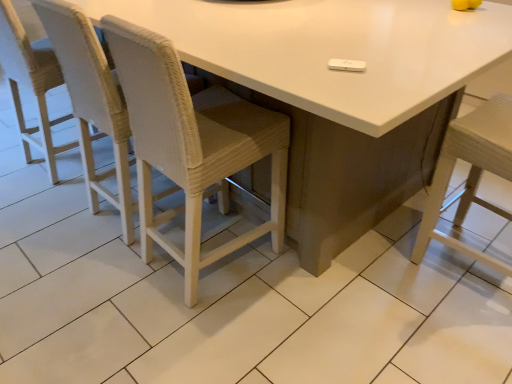
Describe the element at coordinates (31, 84) in the screenshot. This screenshot has width=512, height=384. I see `woven fabric chair at left, the first chair in the left-to-right sequence` at that location.

The image size is (512, 384). What do you see at coordinates (193, 144) in the screenshot?
I see `woven white chair at center, the third chair in the left-to-right sequence` at bounding box center [193, 144].

I want to click on woven white chair at left, which ranks as the second chair in right-to-left order, so click(x=92, y=101).

Considering the sizes of woven white chair at center, the third chair in the left-to-right sequence, and woven white chair at left, which ranks as the second chair in right-to-left order, in the image, is woven white chair at center, the third chair in the left-to-right sequence, wider or thinner than woven white chair at left, which ranks as the second chair in right-to-left order,?

woven white chair at center, the third chair in the left-to-right sequence, is thinner than woven white chair at left, which ranks as the second chair in right-to-left order.

Does woven white chair at center, which is counted as the first chair, starting from the right, turn towards woven white chair at left, which ranks as the second chair in right-to-left order?

No, woven white chair at center, which is counted as the first chair, starting from the right, is not aimed at woven white chair at left, which ranks as the second chair in right-to-left order.

Who is smaller, woven white chair at center, which is counted as the first chair, starting from the right, or woven white chair at left, which ranks as the second chair in right-to-left order?

woven white chair at center, which is counted as the first chair, starting from the right, is smaller.

Considering the positions of objects woven white chair at center, the third chair in the left-to-right sequence, and woven white chair at left, which ranks as the second chair in right-to-left order, in the image provided, who is in front, woven white chair at center, the third chair in the left-to-right sequence, or woven white chair at left, which ranks as the second chair in right-to-left order,?

woven white chair at center, the third chair in the left-to-right sequence, is in front.

Which is behind, point (45, 98) or point (450, 49)?

Point (45, 98)

From the image's perspective, would you say woven fabric chair at left, the 3th chair viewed from the right, is shown under white glossy table at center?

No, from the image's perspective, woven fabric chair at left, the 3th chair viewed from the right, is not beneath white glossy table at center.

From a real-world perspective, who is located higher, woven fabric chair at left, the first chair in the left-to-right sequence, or white glossy table at center?

In real-world perspective, woven fabric chair at left, the first chair in the left-to-right sequence, is above.

Can you confirm if woven fabric chair at left, the 3th chair viewed from the right, is wider than white glossy table at center?

Incorrect, the width of woven fabric chair at left, the 3th chair viewed from the right, does not surpass that of white glossy table at center.

Measure the distance from woven white chair at left, which ranks as the second chair in right-to-left order, to woven white chair at center, which is counted as the first chair, starting from the right.

woven white chair at left, which ranks as the second chair in right-to-left order, and woven white chair at center, which is counted as the first chair, starting from the right, are 13.02 inches apart from each other.

Looking at this image, relative to woven white chair at center, the third chair in the left-to-right sequence, is woven white chair at left, which is the 2th chair from left to right, in front or behind?

woven white chair at left, which is the 2th chair from left to right, is behind woven white chair at center, the third chair in the left-to-right sequence.

From the image's perspective, is woven white chair at left, which ranks as the second chair in right-to-left order, on top of woven white chair at center, the third chair in the left-to-right sequence?

Correct, woven white chair at left, which ranks as the second chair in right-to-left order, appears higher than woven white chair at center, the third chair in the left-to-right sequence, in the image.

Is white glossy table at center bigger or smaller than woven fabric chair at left, the first chair in the left-to-right sequence?

Clearly, white glossy table at center is larger in size than woven fabric chair at left, the first chair in the left-to-right sequence.

In the image, there is a woven fabric chair at left, the 3th chair viewed from the right. Identify the location of table below it (from the image's perspective). The image size is (512, 384). (338, 92).

From a real-world perspective, which is physically below, white glossy table at center or woven fabric chair at left, the first chair in the left-to-right sequence?

white glossy table at center, from a real-world perspective.

Does point (399, 58) appear closer or farther from the camera than point (28, 155)?

Point (399, 58) is closer to the camera than point (28, 155).

Is white glossy table at center thinner than woven white chair at left, which ranks as the second chair in right-to-left order?

No, white glossy table at center is not thinner than woven white chair at left, which ranks as the second chair in right-to-left order.

How much distance is there between white glossy table at center and woven white chair at left, which is the 2th chair from left to right?

white glossy table at center and woven white chair at left, which is the 2th chair from left to right, are 71.02 centimeters apart from each other.

Considering the relative sizes of white glossy table at center and woven white chair at left, which ranks as the second chair in right-to-left order, in the image provided, is white glossy table at center bigger than woven white chair at left, which ranks as the second chair in right-to-left order,?

Yes.

From the image's perspective, is white glossy table at center over woven white chair at center, which is counted as the first chair, starting from the right?

Yes, from the image's perspective, white glossy table at center is on top of woven white chair at center, which is counted as the first chair, starting from the right.

Could woven white chair at center, which is counted as the first chair, starting from the right, be considered to be inside white glossy table at center?

Yes, woven white chair at center, which is counted as the first chair, starting from the right, is a part of white glossy table at center.

Considering the relative positions of white glossy table at center and woven white chair at center, the third chair in the left-to-right sequence, in the image provided, is white glossy table at center to the left of woven white chair at center, the third chair in the left-to-right sequence, from the viewer's perspective?

Incorrect, white glossy table at center is not on the left side of woven white chair at center, the third chair in the left-to-right sequence.

From a real-world perspective, which is physically above, white glossy table at center or woven white chair at center, which is counted as the first chair, starting from the right?

woven white chair at center, which is counted as the first chair, starting from the right, is physically above.

Considering the relative sizes of woven white chair at center, which is counted as the first chair, starting from the right, and white glossy table at center in the image provided, is woven white chair at center, which is counted as the first chair, starting from the right, bigger than white glossy table at center?

No, woven white chair at center, which is counted as the first chair, starting from the right, is not bigger than white glossy table at center.

Relative to white glossy table at center, is woven white chair at center, the third chair in the left-to-right sequence, in front or behind?

Visually, woven white chair at center, the third chair in the left-to-right sequence, is located behind white glossy table at center.

Is woven white chair at center, the third chair in the left-to-right sequence, to the left or to the right of white glossy table at center in the image?

Based on their positions, woven white chair at center, the third chair in the left-to-right sequence, is located to the left of white glossy table at center.

Does point (156, 117) come closer to viewer compared to point (495, 36)?

Yes.

Find the location of a particular element. The height and width of the screenshot is (384, 512). chair that is the 1st object located behind the woven white chair at center, the third chair in the left-to-right sequence is located at coordinates [92, 101].

Find the location of a particular element. The height and width of the screenshot is (384, 512). table directly beneath the woven fabric chair at left, the 3th chair viewed from the right (from a real-world perspective) is located at coordinates (338, 92).

Considering their positions, is white glossy table at center positioned further to woven white chair at left, which ranks as the second chair in right-to-left order, than woven fabric chair at left, the first chair in the left-to-right sequence?

white glossy table at center lies further to woven white chair at left, which ranks as the second chair in right-to-left order, than the other object.

From the image, which object appears to be nearer to woven fabric chair at left, the 3th chair viewed from the right, woven white chair at center, the third chair in the left-to-right sequence, or woven white chair at left, which ranks as the second chair in right-to-left order?

woven white chair at left, which ranks as the second chair in right-to-left order.

Looking at the image, which one is located closer to woven white chair at left, which ranks as the second chair in right-to-left order, woven white chair at center, which is counted as the first chair, starting from the right, or woven fabric chair at left, the first chair in the left-to-right sequence?

woven white chair at center, which is counted as the first chair, starting from the right, is positioned closer to the anchor woven white chair at left, which ranks as the second chair in right-to-left order.

Considering their positions, is woven fabric chair at left, the 3th chair viewed from the right, positioned further to woven white chair at center, the third chair in the left-to-right sequence, than woven white chair at left, which ranks as the second chair in right-to-left order?

woven fabric chair at left, the 3th chair viewed from the right, lies further to woven white chair at center, the third chair in the left-to-right sequence, than the other object.

Looking at the image, which one is located further to woven white chair at center, which is counted as the first chair, starting from the right, white glossy table at center or woven fabric chair at left, the first chair in the left-to-right sequence?

woven fabric chair at left, the first chair in the left-to-right sequence, is positioned further to the anchor woven white chair at center, which is counted as the first chair, starting from the right.

From the image, which object appears to be farther from woven white chair at center, the third chair in the left-to-right sequence, white glossy table at center or woven white chair at left, which is the 2th chair from left to right?

white glossy table at center is further to woven white chair at center, the third chair in the left-to-right sequence.

From the image, which object appears to be farther from white glossy table at center, woven fabric chair at left, the 3th chair viewed from the right, or woven white chair at left, which ranks as the second chair in right-to-left order?

Among the two, woven fabric chair at left, the 3th chair viewed from the right, is located further to white glossy table at center.

Which object lies nearer to the anchor point woven white chair at center, which is counted as the first chair, starting from the right, woven fabric chair at left, the first chair in the left-to-right sequence, or white glossy table at center?

white glossy table at center is closer to woven white chair at center, which is counted as the first chair, starting from the right.

This screenshot has width=512, height=384. Identify the location of chair located between woven white chair at left, which is the 2th chair from left to right, and white glossy table at center in the left-right direction. (193, 144).

Find the location of a particular element. chair situated between woven fabric chair at left, the 3th chair viewed from the right, and woven white chair at center, the third chair in the left-to-right sequence, from left to right is located at coordinates (92, 101).